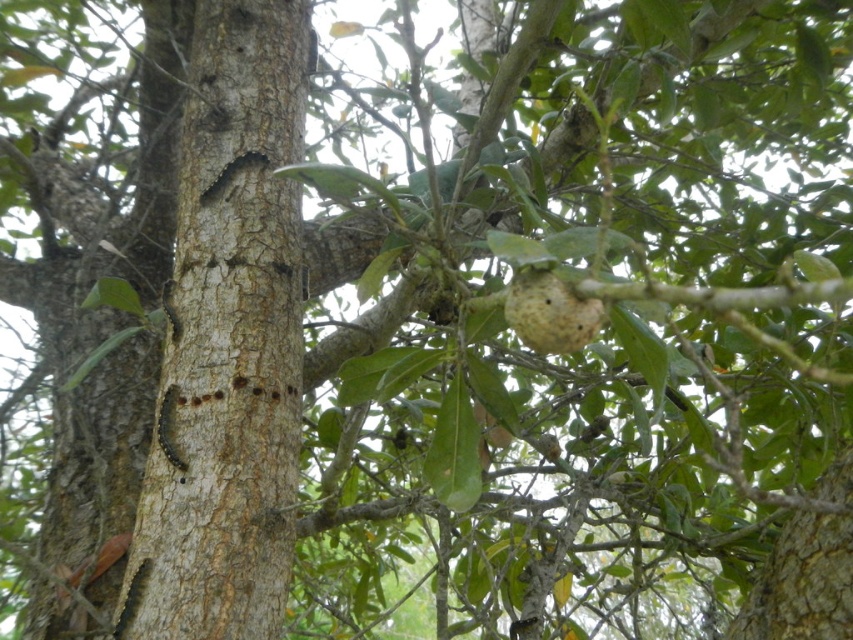
Between point (222, 632) and point (560, 292), which one is positioned in front?

Point (560, 292) is more forward.

Describe the element at coordinates (228, 340) in the screenshot. I see `rough bark tree trunk at center` at that location.

Is point (248, 476) positioned after point (508, 305)?

Yes.

Locate an element on the screen. This screenshot has width=853, height=640. rough bark tree trunk at center is located at coordinates (228, 340).